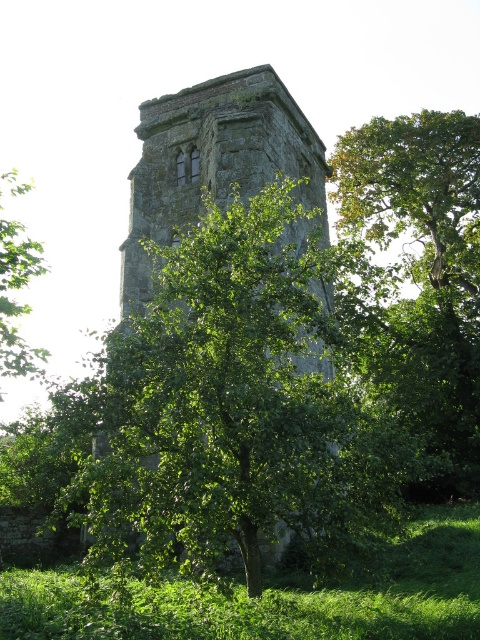
You are a gardener planning to trim the green leafy tree at center near the stone tower at center. Based on their widths, which one is wider?

The green leafy tree at center might be wider than the stone tower at center according to the description provided.

You are standing in front of the historic stone tower and want to walk towards the green leafy tree at center. However, there is a green leafy tree at left in your path. Which tree should you avoid stepping around to reach your destination?

You should avoid stepping around the green leafy tree at left because the green leafy tree at center is closer to the viewer, meaning the tree at left is further away and not blocking your path directly.